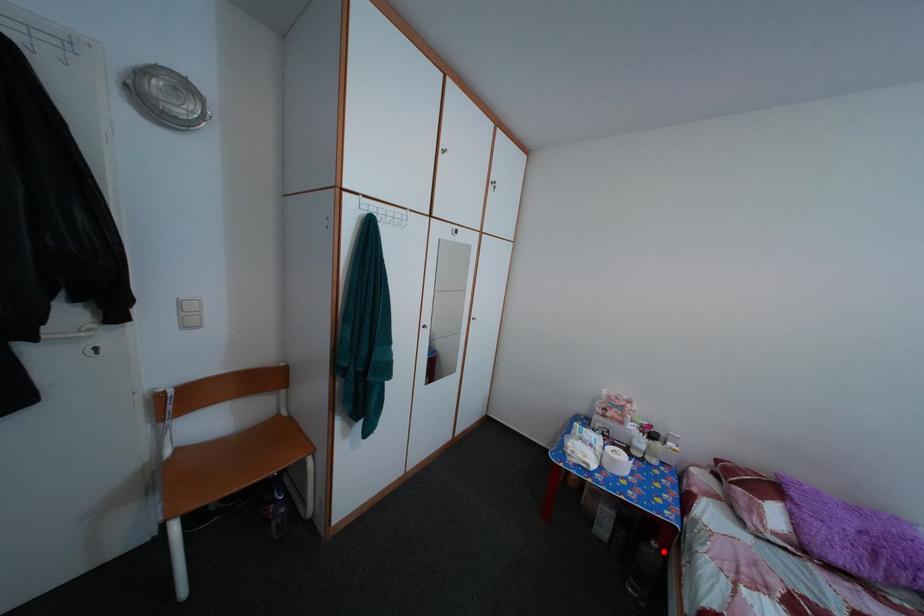
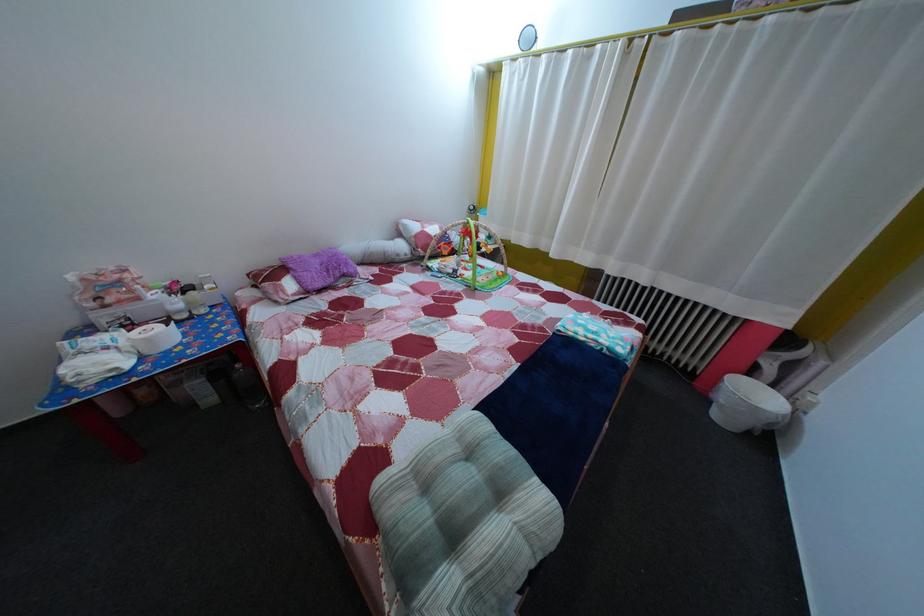
Locate, in the second image, the point that corresponds to the highlighted location in the first image.

(248, 374)